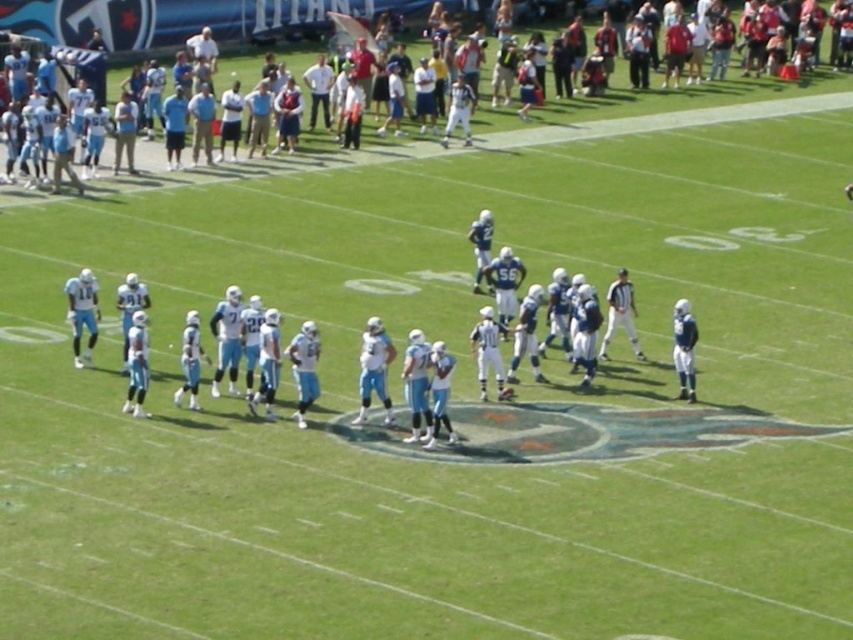
Question: Which of the following is the closest to the observer?

Choices:
 (A) light blue jersey at center
 (B) light blue fabric football team at center

Answer: (B)

Question: Which point is closer to the camera?

Choices:
 (A) light blue jersey at center
 (B) light blue fabric football team at center

Answer: (B)

Question: Does light blue fabric football team at center appear on the left side of light blue jersey at center?

Choices:
 (A) yes
 (B) no

Answer: (B)

Question: Is the position of light blue fabric football team at center less distant than that of light blue jersey at center?

Choices:
 (A) no
 (B) yes

Answer: (B)

Question: Which point is farther to the camera?

Choices:
 (A) (503, 435)
 (B) (144, 26)

Answer: (B)

Question: Can you confirm if light blue fabric football team at center is positioned above light blue jersey at center?

Choices:
 (A) no
 (B) yes

Answer: (A)